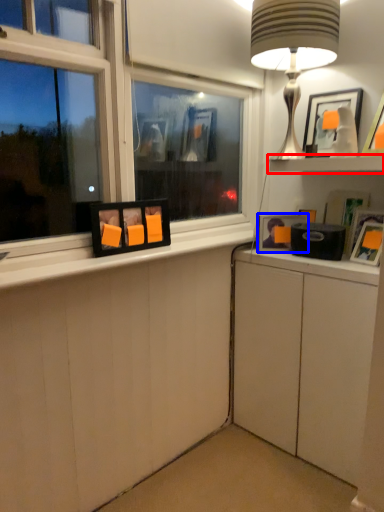
Question: Which object is further to the camera taking this photo, shelf (highlighted by a red box) or picture frame (highlighted by a blue box)?

Choices:
 (A) shelf
 (B) picture frame

Answer: (B)